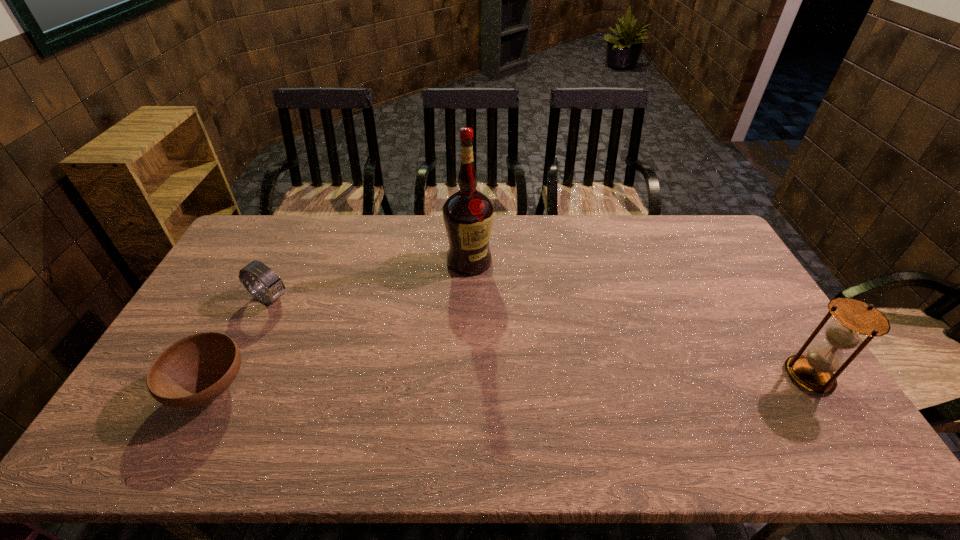
You are a GUI agent. You are given a task and a screenshot of the screen. Output one action in this format:
    pyautogui.click(x=<x>, y=<y>)
    Task: Click on the object present at the right edge
    The image size is (960, 540).
    Given the screenshot: What is the action you would take?
    pyautogui.click(x=814, y=371)

Where is `object at the near left corner`? The height and width of the screenshot is (540, 960). object at the near left corner is located at coordinates click(197, 369).

At what (x,y) coordinates should I click in order to perform the action: click on object present at the near right corner. Please return your answer as a coordinate pair (x, y). The height and width of the screenshot is (540, 960). Looking at the image, I should click on (814, 371).

The height and width of the screenshot is (540, 960). In the image, there is a desktop. What are the coordinates of `blank space at the far edge` in the screenshot? It's located at (419, 220).

In the image, there is a desktop. At what (x,y) coordinates should I click in order to perform the action: click on vacant space at the near edge. Please return your answer as a coordinate pair (x, y). The image size is (960, 540). Looking at the image, I should click on (492, 401).

In the image, there is a desktop. Identify the location of free space at the right edge. The width and height of the screenshot is (960, 540). (721, 294).

The image size is (960, 540). In the image, there is a desktop. Find the location of `free space at the far left corner`. free space at the far left corner is located at coordinates (235, 247).

Where is `vacant region between the second farthest object and the alcohol`? This screenshot has width=960, height=540. vacant region between the second farthest object and the alcohol is located at coordinates (370, 280).

The image size is (960, 540). I want to click on empty location between the watch and the alcohol, so click(370, 280).

Locate an element on the screen. The width and height of the screenshot is (960, 540). empty location between the second shortest object and the bowl is located at coordinates (240, 343).